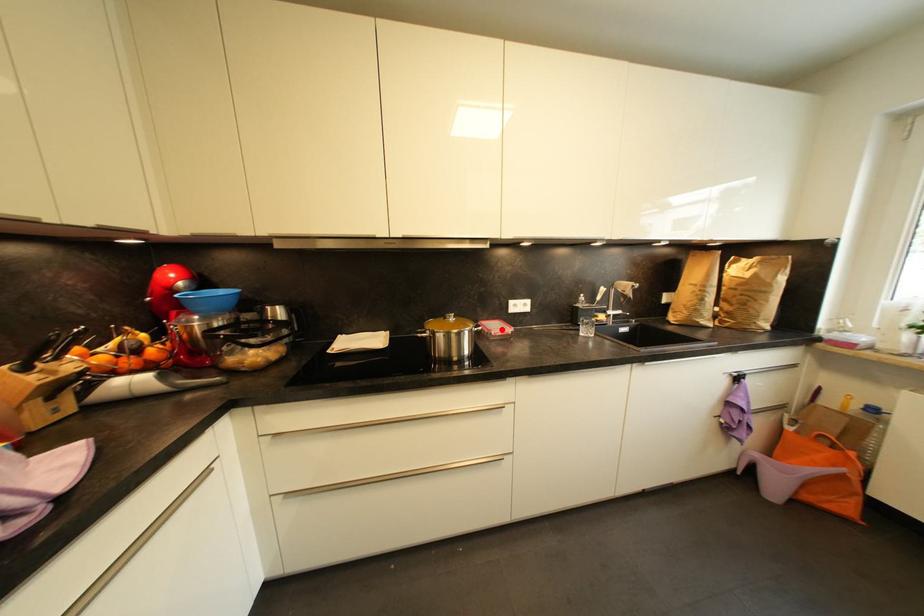
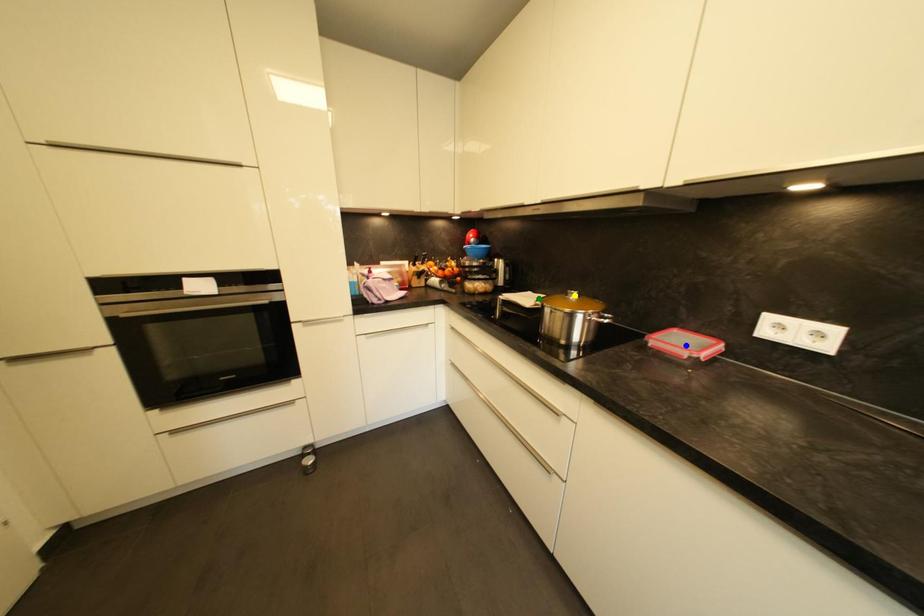
Question: I am providing you with two images of the same scene from different viewpoints. A red point is marked on the first image. You are given multiple points on the second image. Can you choose the point in image 2 that corresponds to the point in image 1?

Choices:
 (A) yellow point
 (B) green point
 (C) blue point

Answer: (C)